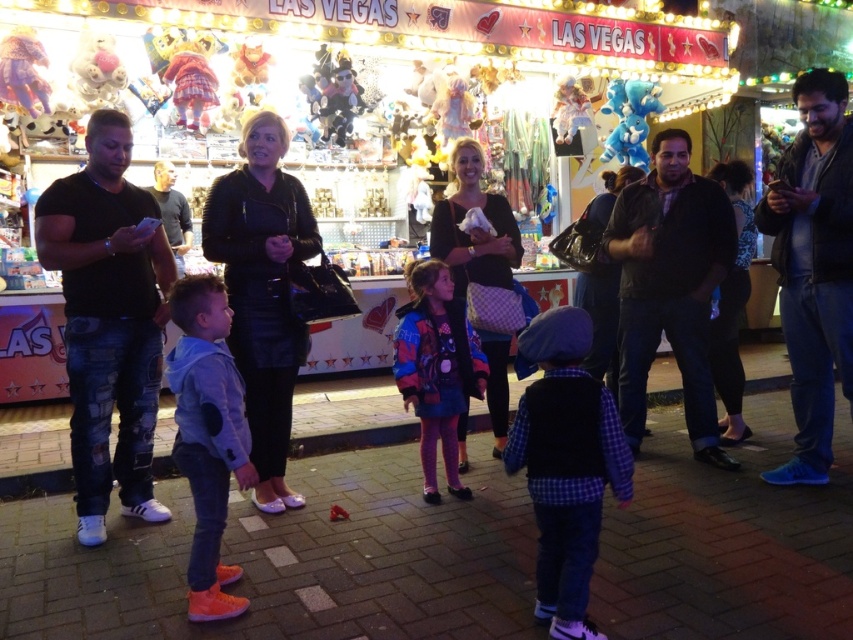
Question: Does dark blue jeans at center appear over dark brown leather jacket at right?

Choices:
 (A) yes
 (B) no

Answer: (A)

Question: Which object is positioned farthest from the dark blue jeans at center?

Choices:
 (A) plaid fabric vest at center
 (B) black cotton t-shirt at left
 (C) light blue denim jacket at center
 (D) dark brown leather jacket at right

Answer: (B)

Question: Does dark brown leather jacket at right have a greater width compared to multicolored fabric jacket at center?

Choices:
 (A) no
 (B) yes

Answer: (B)

Question: Is black cotton t-shirt at left smaller than light blue denim jacket at center?

Choices:
 (A) no
 (B) yes

Answer: (A)

Question: Which is farther from the dark blue jeans at center?

Choices:
 (A) black cotton t-shirt at left
 (B) multicolored fabric jacket at center

Answer: (A)

Question: Which point is closer to the camera?

Choices:
 (A) dark brown leather jacket at right
 (B) light blue denim jacket at center

Answer: (B)